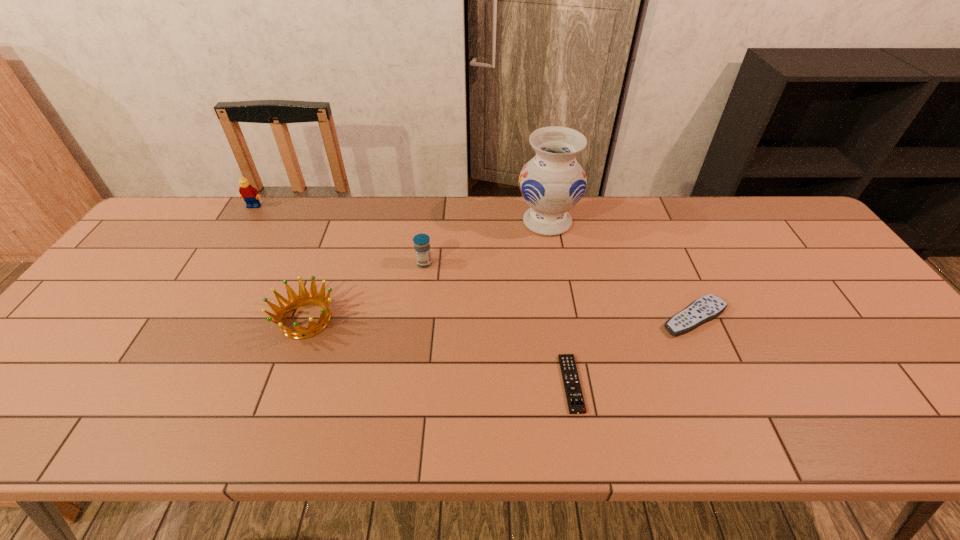
Locate an element on the screen. The image size is (960, 540). vacant area situated 0.060m on the front-facing side of the leftmost object is located at coordinates (246, 220).

At what (x,y) coordinates should I click in order to perform the action: click on free space located 0.170m on the left of the third farthest object. Please return your answer as a coordinate pair (x, y). Looking at the image, I should click on (357, 264).

Find the location of a particular element. vacant position located 0.170m on the back of the crown is located at coordinates (330, 254).

The width and height of the screenshot is (960, 540). I want to click on vacant space located on the back of the rightmost object, so click(656, 230).

I want to click on free location located on the right of the nearest object, so click(x=702, y=383).

I want to click on vase positioned at the far edge, so tap(552, 182).

Where is `Lego present at the far edge`? The width and height of the screenshot is (960, 540). Lego present at the far edge is located at coordinates (250, 194).

This screenshot has height=540, width=960. In order to click on object that is at the near edge in this screenshot , I will do `click(575, 400)`.

Identify the location of free space at the far edge of the desktop. The image size is (960, 540). (308, 239).

Image resolution: width=960 pixels, height=540 pixels. In order to click on vacant position at the near edge of the desktop in this screenshot , I will do `click(511, 435)`.